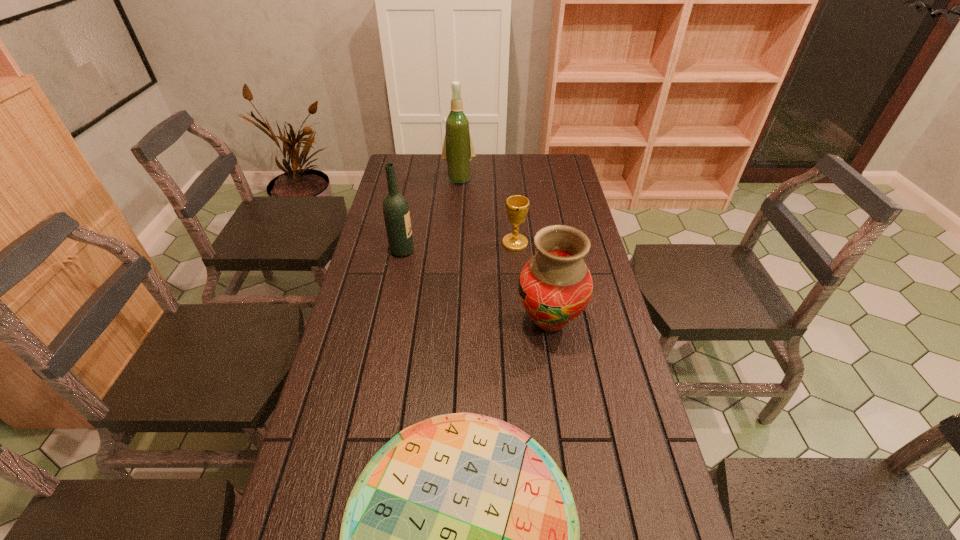
Point out which object is positioned as the third nearest to the nearest object. Please provide its 2D coordinates. Your answer should be formatted as a tuple, i.e. [(x, y)], where the tuple contains the x and y coordinates of a point satisfying the conditions above.

[(517, 206)]

Where is `blank area in the image that satisfies the following two spatial constraints: 1. on the front-facing side of the tallest object; 2. on the labeled side of the nearer wine bottle`? The image size is (960, 540). blank area in the image that satisfies the following two spatial constraints: 1. on the front-facing side of the tallest object; 2. on the labeled side of the nearer wine bottle is located at coordinates (454, 251).

Find the location of a particular element. The width and height of the screenshot is (960, 540). vacant area in the image that satisfies the following two spatial constraints: 1. on the front-facing side of the right wine bottle; 2. on the labeled side of the nearer wine bottle is located at coordinates (454, 251).